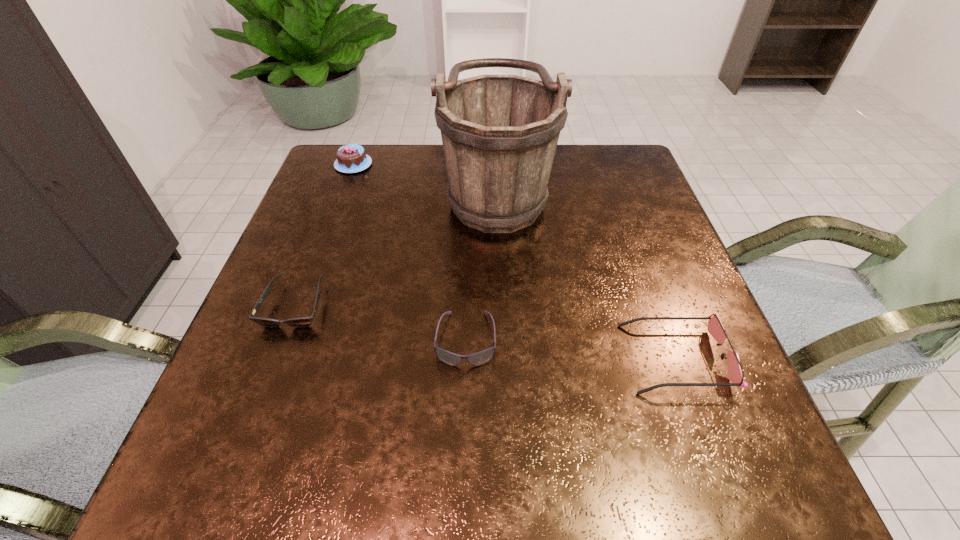
Locate an element on the screen. blank region between the chocolate cake and the second sunglasses from left to right is located at coordinates (410, 252).

This screenshot has width=960, height=540. I want to click on vacant point located between the second sunglasses from right to left and the tallest object, so click(x=481, y=264).

This screenshot has width=960, height=540. I want to click on unoccupied position between the leftmost sunglasses and the bucket, so click(396, 248).

The height and width of the screenshot is (540, 960). I want to click on free space that is in between the tallest object and the tallest sunglasses, so click(587, 274).

Where is `free area in between the leftmost sunglasses and the chocolate cake`? Image resolution: width=960 pixels, height=540 pixels. free area in between the leftmost sunglasses and the chocolate cake is located at coordinates (324, 235).

Identify the location of free area in between the second sunglasses from right to left and the chocolate cake. (410, 252).

Choose which object is the nearest neighbor to the leftmost sunglasses. Please provide its 2D coordinates. Your answer should be formatted as a tuple, i.e. [(x, y)], where the tuple contains the x and y coordinates of a point satisfying the conditions above.

[(476, 359)]

Select which object appears as the second closest to the second sunglasses from right to left. Please provide its 2D coordinates. Your answer should be formatted as a tuple, i.e. [(x, y)], where the tuple contains the x and y coordinates of a point satisfying the conditions above.

[(302, 321)]

Locate an element on the screen. The width and height of the screenshot is (960, 540). sunglasses that is the closest one to the tallest object is located at coordinates (476, 359).

Locate an element on the screen. The width and height of the screenshot is (960, 540). sunglasses that stands as the second closest to the chocolate cake is located at coordinates 476,359.